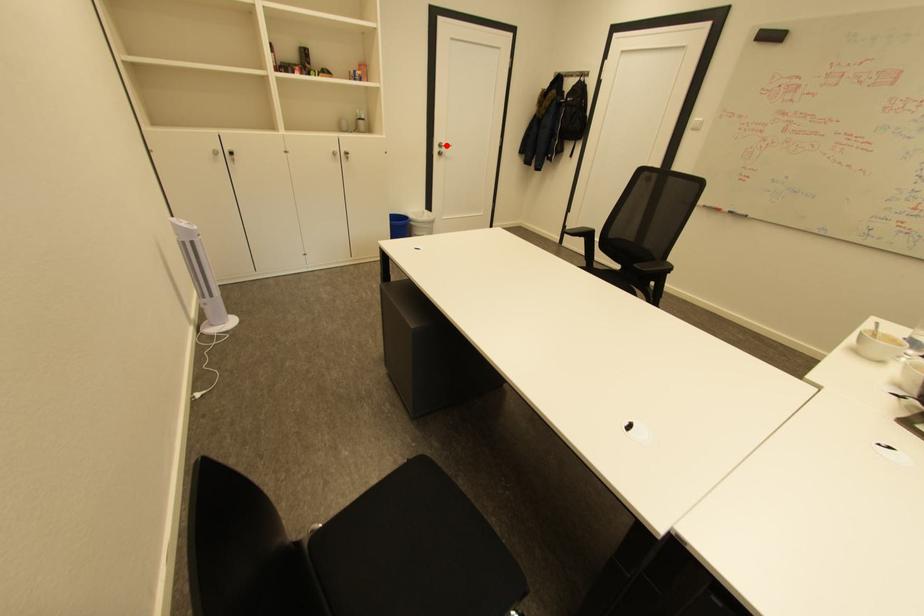
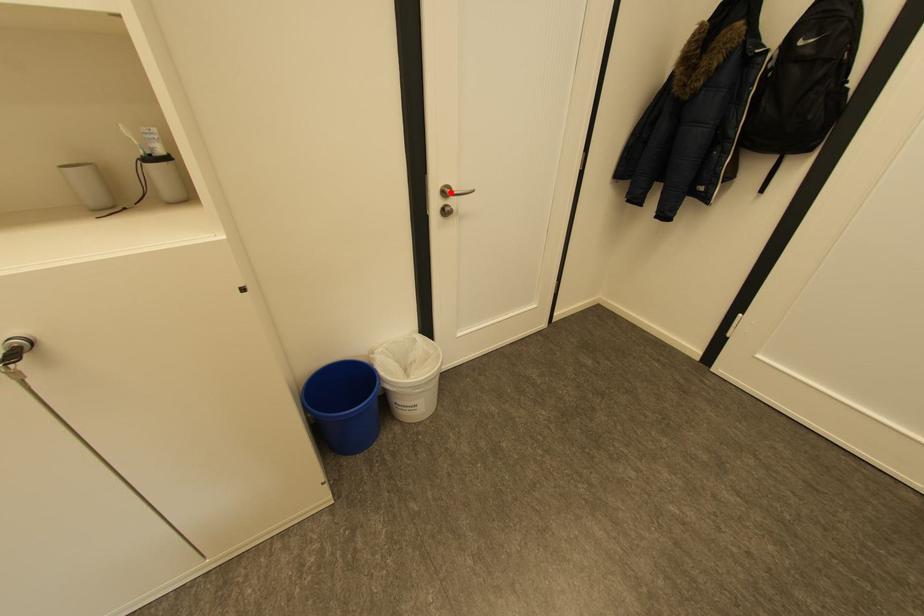
I am providing you with two images of the same scene from different viewpoints. A red point is marked on the first image and another point is marked on the second image. Does the point marked in image1 correspond to the same location as the one in image2?

Yes